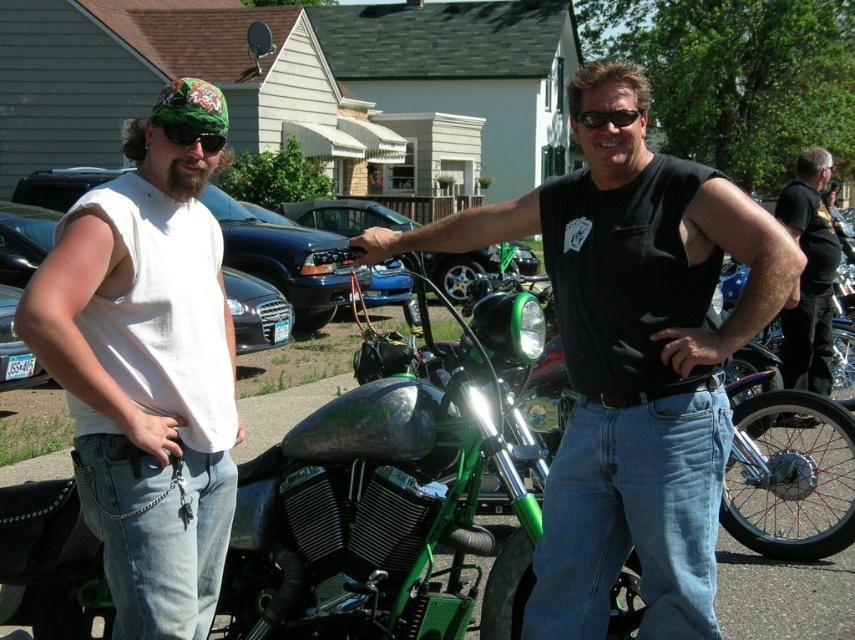
Who is taller, white cotton tank top at left or black plastic sunglasses at upper center?

white cotton tank top at left is taller.

How far apart are white cotton tank top at left and black plastic sunglasses at upper center?

white cotton tank top at left is 5.15 feet away from black plastic sunglasses at upper center.

The width and height of the screenshot is (855, 640). I want to click on white cotton tank top at left, so click(x=146, y=369).

Find the location of a particular element. white cotton tank top at left is located at coordinates (146, 369).

Locate an element on the screen. black leather jacket at upper right is located at coordinates (808, 275).

Does black leather jacket at upper right have a lesser height compared to black plastic sunglasses at upper center?

No.

Who is more distant from viewer, (833, 273) or (588, 124)?

The point (833, 273) is behind.

Image resolution: width=855 pixels, height=640 pixels. I want to click on black leather jacket at upper right, so click(x=808, y=275).

Who is shorter, black sleeveless shirt at center or black leather jacket at upper right?

black sleeveless shirt at center is shorter.

Does black sleeveless shirt at center appear under black leather jacket at upper right?

No, black sleeveless shirt at center is not below black leather jacket at upper right.

Between point (768, 291) and point (806, 211), which one is positioned behind?

Positioned behind is point (806, 211).

Where is `black sleeveless shirt at center`? black sleeveless shirt at center is located at coordinates (631, 358).